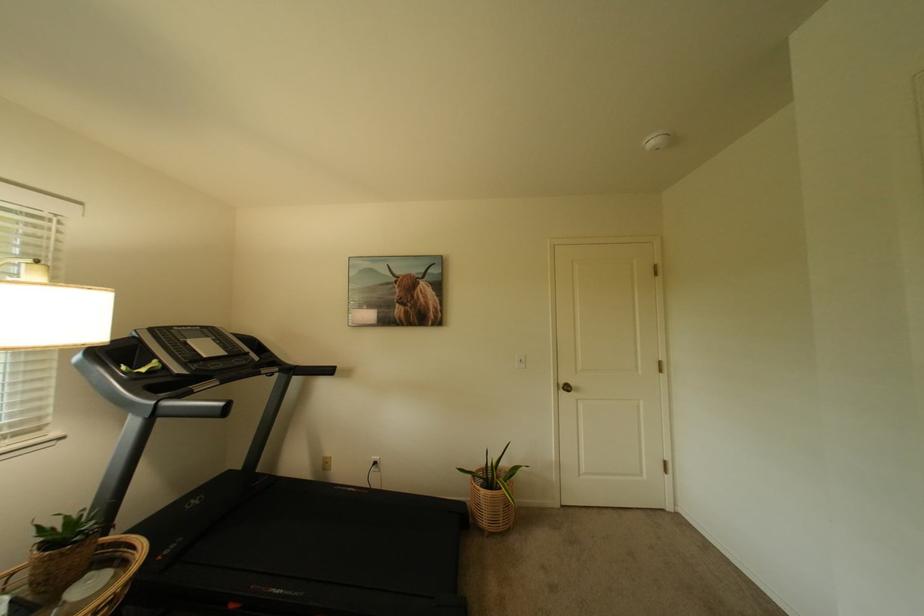
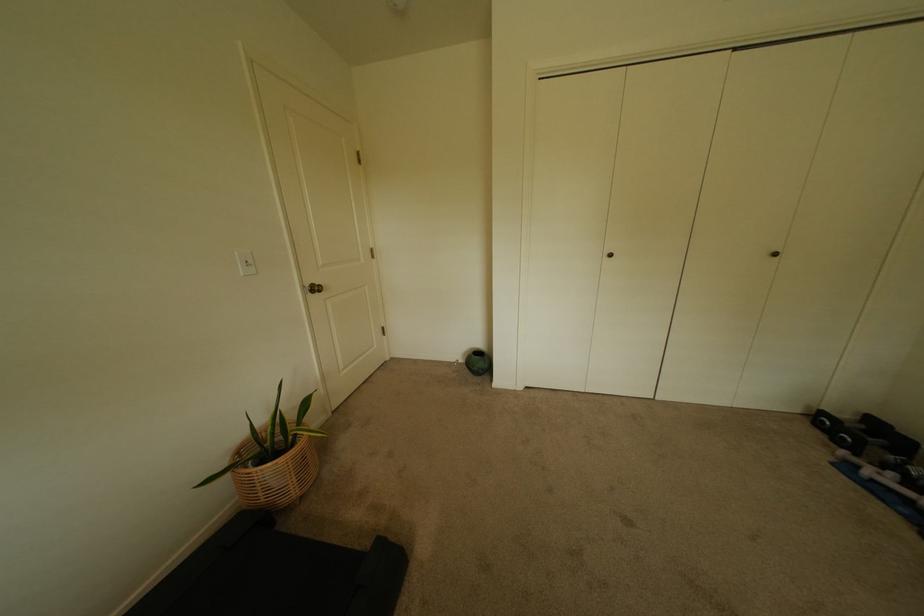
How did the camera likely rotate?

The rotation direction of the camera is right-down.